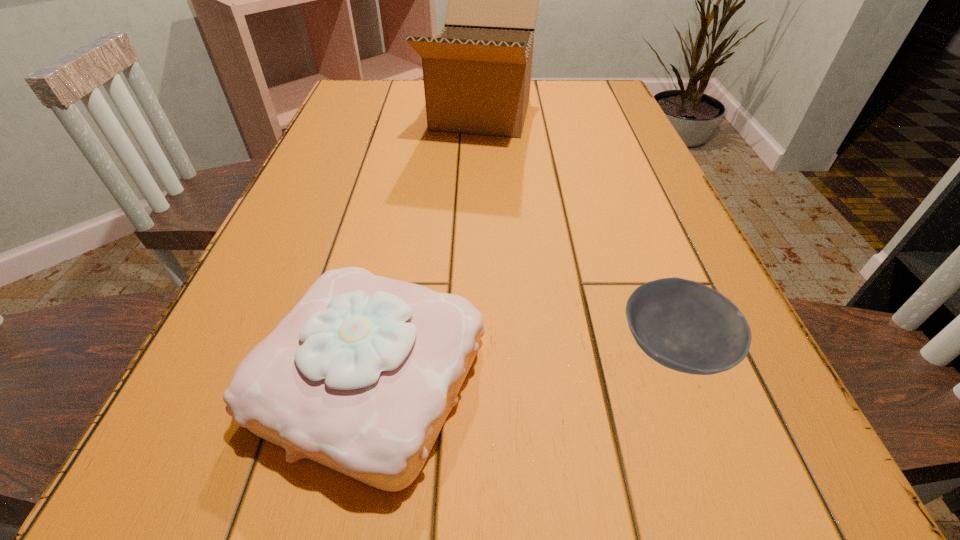
The width and height of the screenshot is (960, 540). I want to click on free space that is in between the shortest object and the second tallest object, so click(521, 365).

Locate an element on the screen. vacant area that lies between the shortest object and the farthest object is located at coordinates (577, 232).

Find the location of a particular element. Image resolution: width=960 pixels, height=540 pixels. free space that is in between the cake and the bowl is located at coordinates (521, 365).

Image resolution: width=960 pixels, height=540 pixels. What are the coordinates of `blank region between the bowl and the second tallest object` in the screenshot? It's located at (521, 365).

The height and width of the screenshot is (540, 960). I want to click on blank region between the box and the rightmost object, so click(x=577, y=232).

I want to click on empty location between the second tallest object and the rightmost object, so click(521, 365).

At what (x,y) coordinates should I click in order to perform the action: click on empty space that is in between the bowl and the tallest object. Please return your answer as a coordinate pair (x, y). Looking at the image, I should click on (577, 232).

Locate an element on the screen. The height and width of the screenshot is (540, 960). empty space between the rightmost object and the second shortest object is located at coordinates (521, 365).

Locate which object ranks second in proximity to the shortest object. Please provide its 2D coordinates. Your answer should be formatted as a tuple, i.e. [(x, y)], where the tuple contains the x and y coordinates of a point satisfying the conditions above.

[(477, 73)]

Locate which object ranks second in proximity to the second shortest object. Please provide its 2D coordinates. Your answer should be formatted as a tuple, i.e. [(x, y)], where the tuple contains the x and y coordinates of a point satisfying the conditions above.

[(477, 73)]